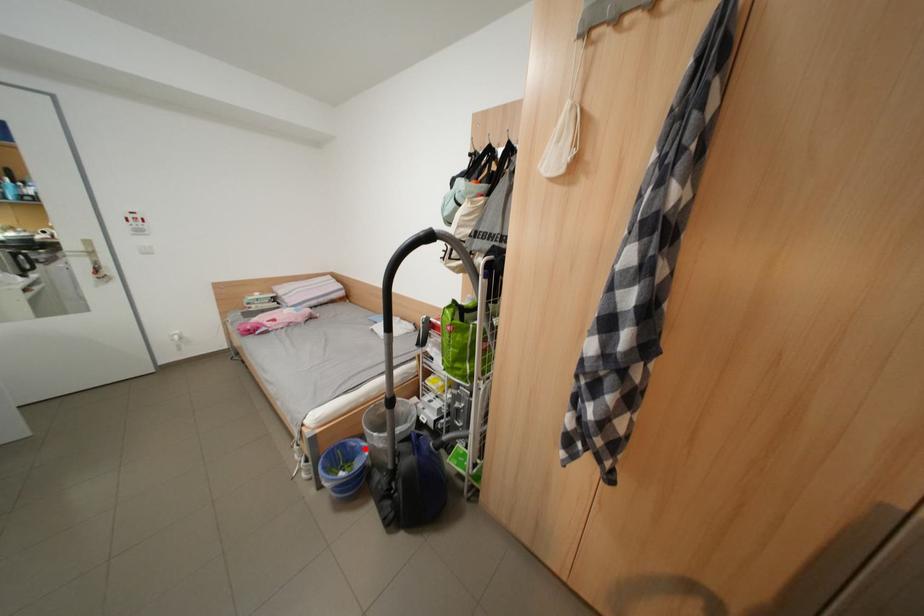
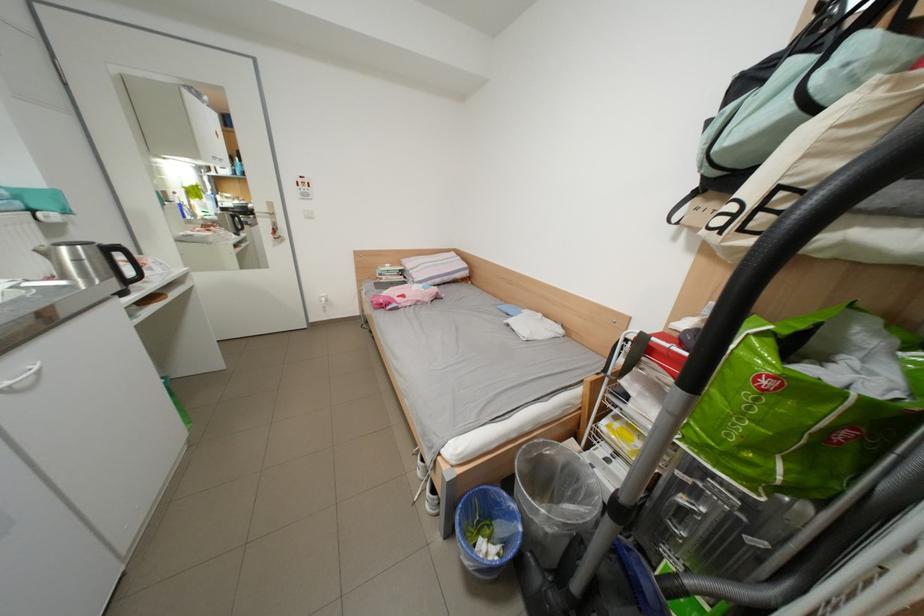
Question: I am providing you with two images of the same scene from different viewpoints. A red point is marked on the first image. Can you still see the location of the red point in image 2?

Choices:
 (A) Yes
 (B) No

Answer: (A)